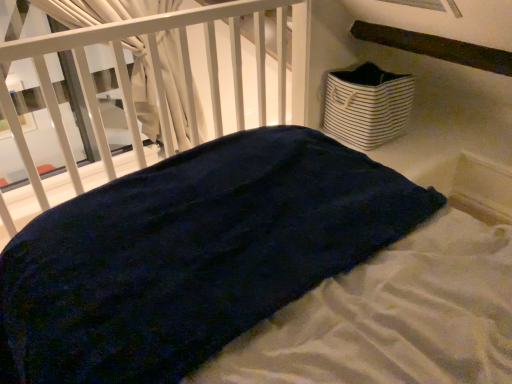
Question: From a real-world perspective, is dark blue plush at center over white striped fabric basket at upper right?

Choices:
 (A) no
 (B) yes

Answer: (B)

Question: From the image's perspective, is dark blue plush at center on top of white striped fabric basket at upper right?

Choices:
 (A) yes
 (B) no

Answer: (B)

Question: Does dark blue plush at center have a greater height compared to white striped fabric basket at upper right?

Choices:
 (A) yes
 (B) no

Answer: (A)

Question: From the image's perspective, is dark blue plush at center located beneath white striped fabric basket at upper right?

Choices:
 (A) no
 (B) yes

Answer: (B)

Question: Can you confirm if dark blue plush at center is bigger than white striped fabric basket at upper right?

Choices:
 (A) no
 (B) yes

Answer: (B)

Question: Does dark blue plush at center have a lesser width compared to white striped fabric basket at upper right?

Choices:
 (A) yes
 (B) no

Answer: (B)

Question: From the image's perspective, is white striped fabric basket at upper right over dark blue plush at center?

Choices:
 (A) yes
 (B) no

Answer: (A)

Question: Considering the relative sizes of white striped fabric basket at upper right and dark blue plush at center in the image provided, is white striped fabric basket at upper right bigger than dark blue plush at center?

Choices:
 (A) yes
 (B) no

Answer: (B)

Question: Is white striped fabric basket at upper right surrounding dark blue plush at center?

Choices:
 (A) yes
 (B) no

Answer: (B)

Question: Is white striped fabric basket at upper right oriented towards dark blue plush at center?

Choices:
 (A) no
 (B) yes

Answer: (B)

Question: Are white striped fabric basket at upper right and dark blue plush at center beside each other?

Choices:
 (A) no
 (B) yes

Answer: (A)

Question: Can you confirm if white striped fabric basket at upper right is smaller than dark blue plush at center?

Choices:
 (A) yes
 (B) no

Answer: (A)

Question: Would you say white striped fabric basket at upper right is inside or outside dark blue plush at center?

Choices:
 (A) inside
 (B) outside

Answer: (B)